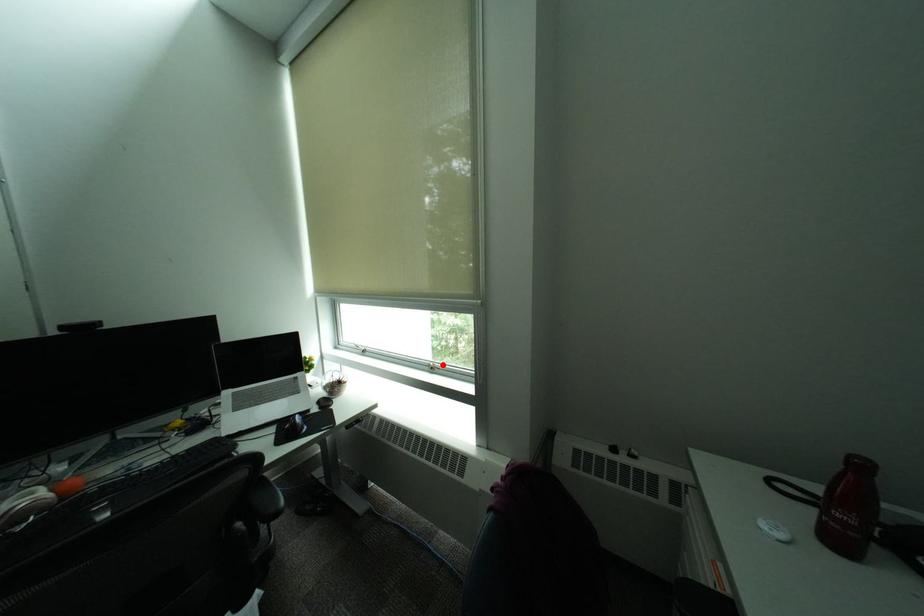
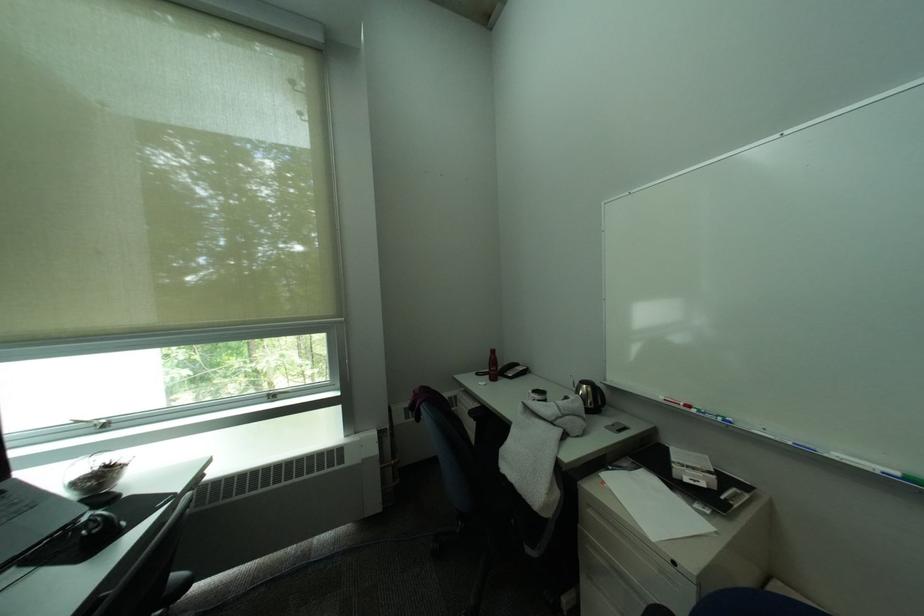
Question: A red point is marked in image1. In image2, is the corresponding 3D point closer to the camera or farther? Reply with the corresponding letter.

Choices:
 (A) The corresponding 3D point is closer.
 (B) The corresponding 3D point is farther.

Answer: (A)